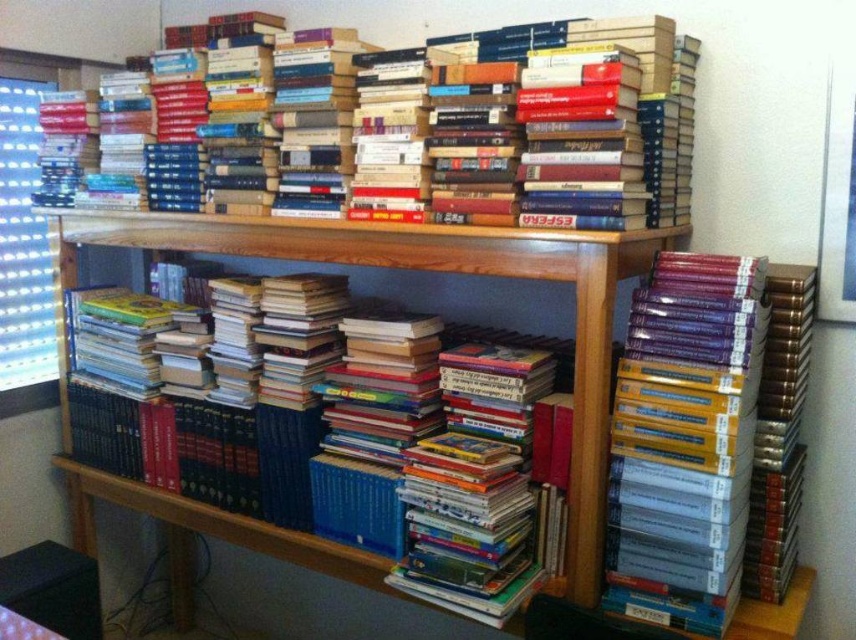
Which is behind, point (443, 150) or point (516, 259)?

Point (443, 150)

Can you confirm if hardcover books at upper center is positioned below wooden bookshelf at center?

Actually, hardcover books at upper center is above wooden bookshelf at center.

Who is more distant from viewer, (691, 93) or (587, 260)?

Positioned behind is point (691, 93).

Locate an element on the screen. hardcover books at upper center is located at coordinates (542, 132).